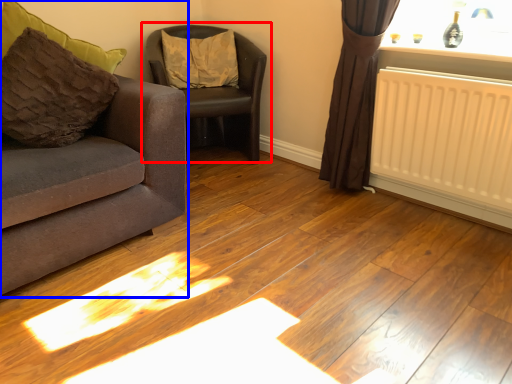
Question: Which point is closer to the camera, chair (highlighted by a red box) or studio couch (highlighted by a blue box)?

Choices:
 (A) chair
 (B) studio couch

Answer: (B)